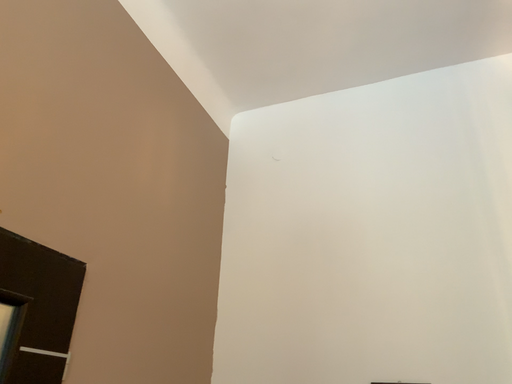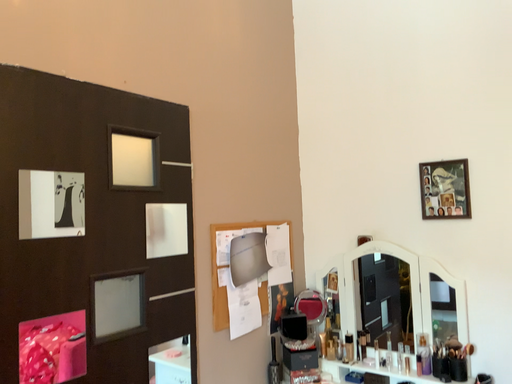
Question: How did the camera likely rotate when shooting the video?

Choices:
 (A) rotated right
 (B) rotated left

Answer: (B)